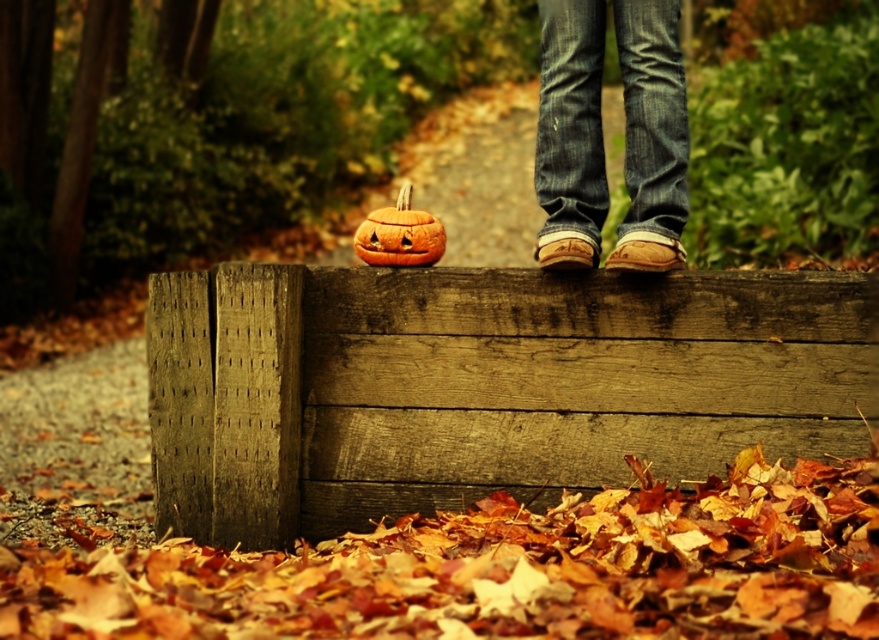
Is point (677, 368) closer to camera compared to point (774, 625)?

No, it is behind (774, 625).

Is weathered wood at center shorter than autumn leaves at lower center?

In fact, weathered wood at center may be taller than autumn leaves at lower center.

Is point (423, 371) more distant than point (539, 595)?

Yes, it is.

Find the location of a particular element. The image size is (879, 640). weathered wood at center is located at coordinates (480, 385).

What do you see at coordinates (480, 385) in the screenshot? Image resolution: width=879 pixels, height=640 pixels. I see `weathered wood at center` at bounding box center [480, 385].

Does weathered wood at center appear on the left side of denim jeans at center?

Correct, you'll find weathered wood at center to the left of denim jeans at center.

This screenshot has width=879, height=640. What do you see at coordinates (480, 385) in the screenshot?
I see `weathered wood at center` at bounding box center [480, 385].

At what (x,y) coordinates should I click in order to perform the action: click on weathered wood at center. Please return your answer as a coordinate pair (x, y). Looking at the image, I should click on (480, 385).

Can you confirm if autumn leaves at lower center is smaller than orange matte pumpkin at center?

No.

Does autumn leaves at lower center have a lesser height compared to orange matte pumpkin at center?

No.

Locate an element on the screen. The height and width of the screenshot is (640, 879). autumn leaves at lower center is located at coordinates (503, 570).

Find the location of a particular element. This screenshot has height=640, width=879. autumn leaves at lower center is located at coordinates (503, 570).